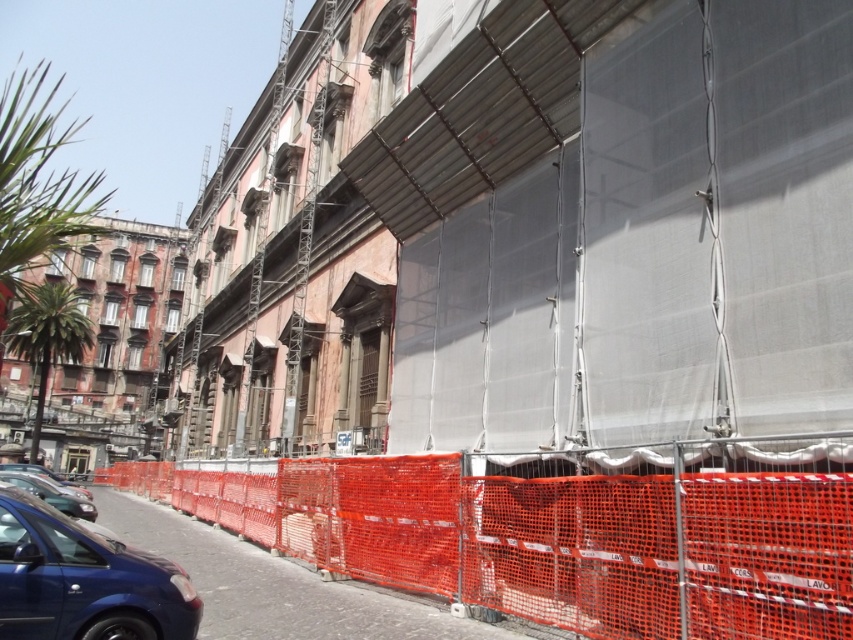
You are a delivery person needing to pass through the construction area shown. The orange mesh fence at lower left is the only entrance. Can you safely walk through it if your delivery cart is 2 meters wide?

The orange mesh fence at lower left is 6.67 meters from camera, so yes, the delivery cart can pass through the entrance since the distance is sufficient. However, the question mentions the width of the cart but the description provides distance from camera, not the width of the entrance. Therefore, the answer cannot be determined with the given information.

You are a delivery driver who needs to park your truck near the orange mesh fence at lower left and the matte black car at lower left. Based on the scene, can you park your truck between them without overlapping either?

The orange mesh fence at lower left is positioned over the matte black car at lower left, meaning they are stacked vertically rather than side by side. Since they are not adjacent horizontally, there is no space between them for the truck to park. Therefore, you cannot park between them without overlapping either object.